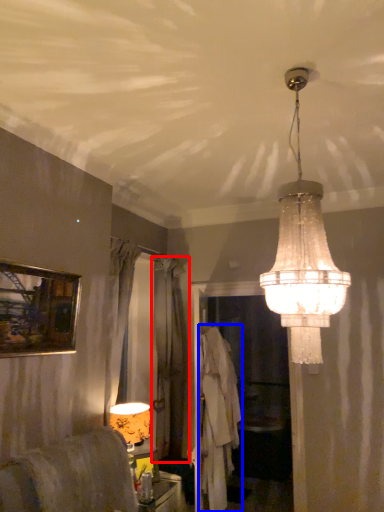
Question: Which object is closer to the camera taking this photo, curtain (highlighted by a red box) or robe (highlighted by a blue box)?

Choices:
 (A) curtain
 (B) robe

Answer: (B)